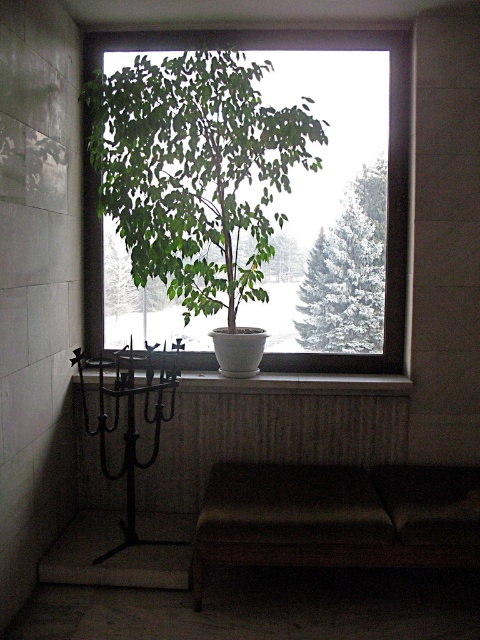
Question: Does white ceramic plant at center have a smaller size compared to white ceramic pot at center?

Choices:
 (A) no
 (B) yes

Answer: (A)

Question: Which object is the closest to the white ceramic plant at center?

Choices:
 (A) white ceramic pot at center
 (B) green matte tree at center

Answer: (B)

Question: Is the position of white ceramic plant at center less distant than that of green matte tree at center?

Choices:
 (A) no
 (B) yes

Answer: (B)

Question: Does green matte tree at center appear on the left side of black metal candle holder at left?

Choices:
 (A) no
 (B) yes

Answer: (A)

Question: Which object is positioned farthest from the white ceramic plant at center?

Choices:
 (A) black metal candle holder at left
 (B) white ceramic pot at center
 (C) green matte tree at center

Answer: (B)

Question: Which point is closer to the camera taking this photo?

Choices:
 (A) 324,285
 (B) 195,381
 (C) 361,333

Answer: (B)